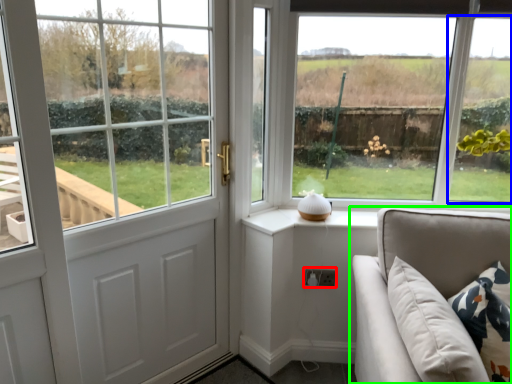
Question: Based on their relative distances, which object is farther from electric outlet (highlighted by a red box)? Choose from window (highlighted by a blue box) and studio couch (highlighted by a green box).

Choices:
 (A) window
 (B) studio couch

Answer: (A)